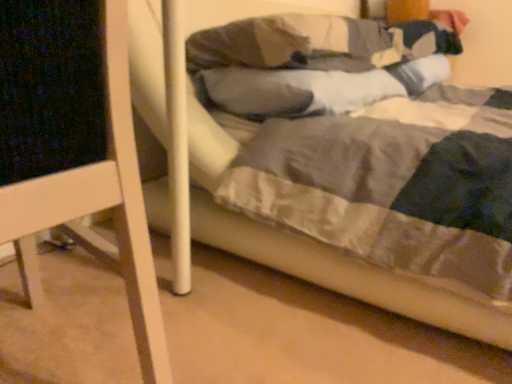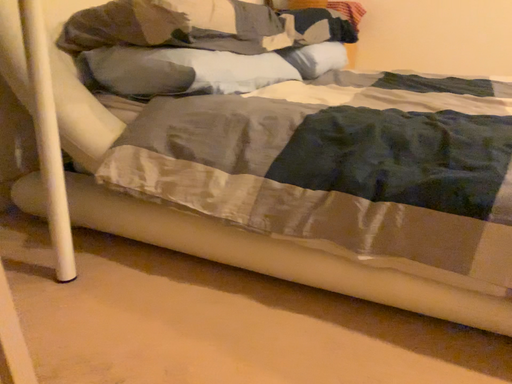
Question: How did the camera likely rotate when shooting the video?

Choices:
 (A) rotated left
 (B) rotated right

Answer: (B)